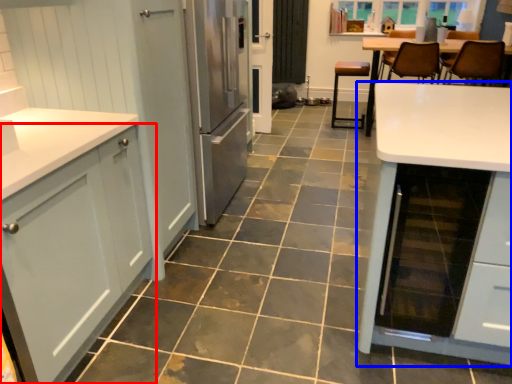
Question: Which of the following is the farthest to the observer, cabinetry (highlighted by a red box) or table (highlighted by a blue box)?

Choices:
 (A) cabinetry
 (B) table

Answer: (B)